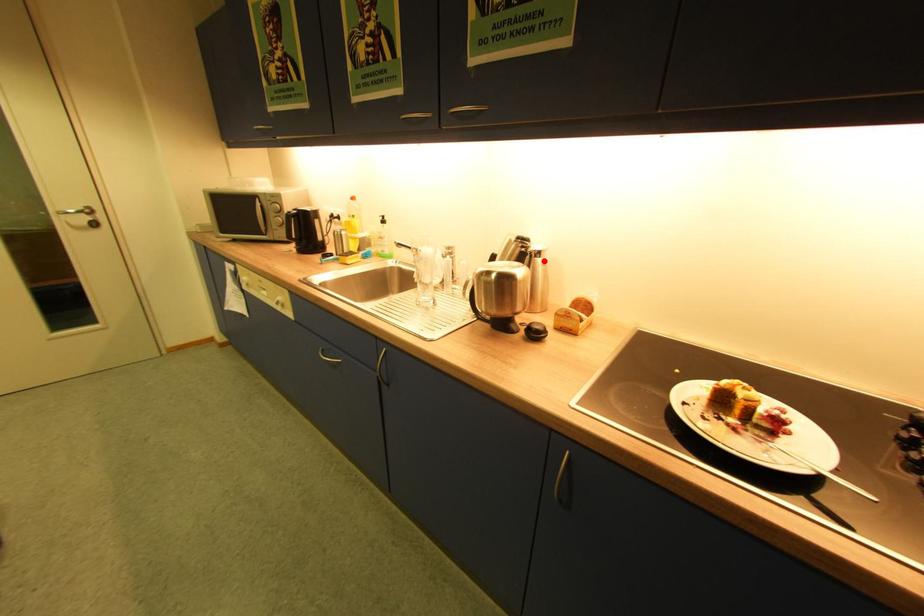
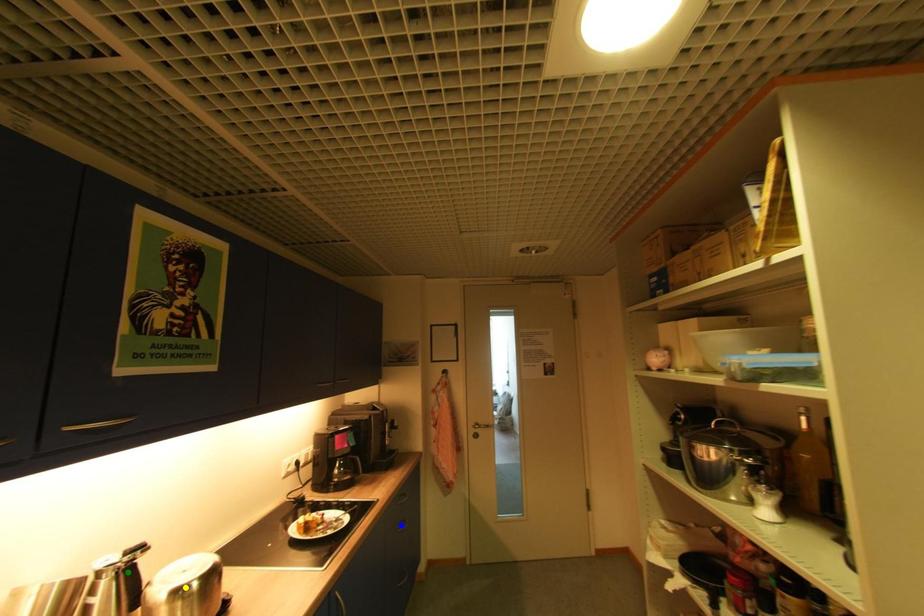
Question: I am providing you with two images of the same scene from different viewpoints. A red point is marked on the first image. You are given multiple points on the second image. Which point in image 2 represents the same 3d spot as the red point in image 1?

Choices:
 (A) green point
 (B) blue point
 (C) yellow point

Answer: (A)